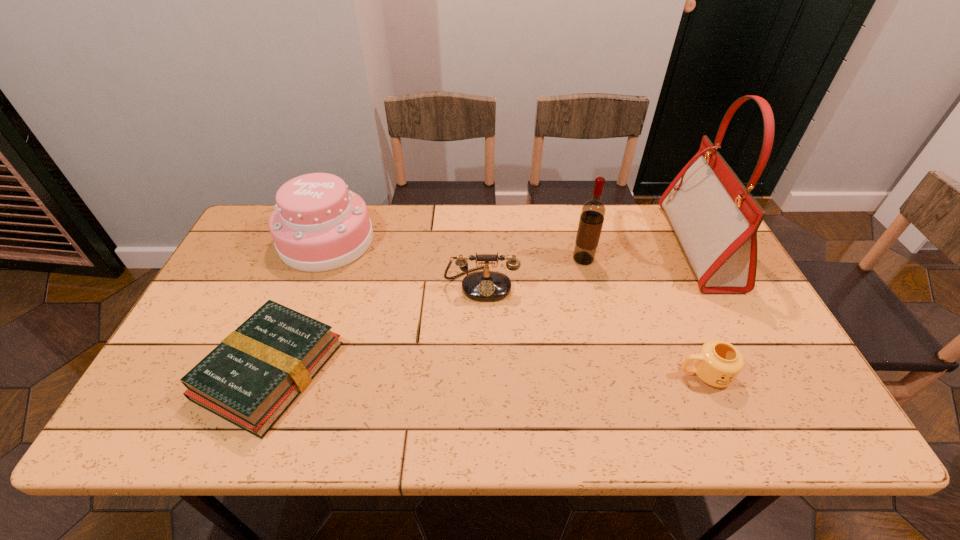
Image resolution: width=960 pixels, height=540 pixels. Find the location of `free region located 0.340m on the left of the handbag`. free region located 0.340m on the left of the handbag is located at coordinates (566, 246).

Locate an element on the screen. This screenshot has width=960, height=540. free space located on the front of the wine bottle is located at coordinates (612, 376).

Find the location of a particular element. vacant space located on the right of the birthday cake is located at coordinates (408, 240).

Find the location of a particular element. vacant space situated 0.230m on the dial of the fourth tallest object is located at coordinates (482, 375).

The image size is (960, 540). Find the location of `vacant space located 0.240m on the handle side of the second object from right to left`. vacant space located 0.240m on the handle side of the second object from right to left is located at coordinates (577, 374).

You are a GUI agent. You are given a task and a screenshot of the screen. Output one action in this format:
    pyautogui.click(x=<x>, y=<y>)
    Task: Click on the vacant area located 0.290m on the handle side of the second object from right to left
    The width and height of the screenshot is (960, 540).
    Given the screenshot: What is the action you would take?
    pyautogui.click(x=556, y=374)

Find the location of `blank space located 0.080m on the handle side of the second object from right to left`. blank space located 0.080m on the handle side of the second object from right to left is located at coordinates (644, 374).

This screenshot has height=540, width=960. What are the coordinates of `free space located on the right of the hardback book` in the screenshot? It's located at (361, 370).

Locate an element on the screen. This screenshot has width=960, height=540. handbag situated at the far edge is located at coordinates (715, 218).

Find the location of a particular element. birthday cake that is positioned at the far edge is located at coordinates (318, 225).